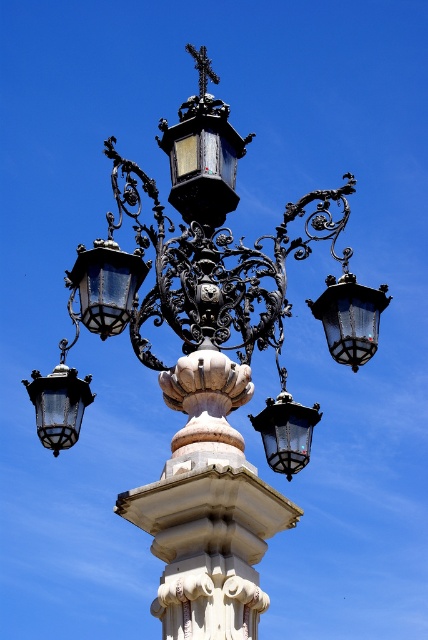
Question: Considering the real-world distances, which object is farthest from the matte black lantern at center?

Choices:
 (A) matte black lantern at upper left
 (B) clear glass lantern at upper right

Answer: (A)

Question: Where is matte black lantern at upper left located in relation to matte black lantern at lower left in the image?

Choices:
 (A) right
 (B) left

Answer: (A)

Question: Is clear glass lantern at upper right positioned before matte black lantern at center?

Choices:
 (A) yes
 (B) no

Answer: (A)

Question: Which point is closer to the camera taking this photo?

Choices:
 (A) (76, 316)
 (B) (297, 468)

Answer: (A)

Question: Considering the relative positions of matte black lantern at upper left and matte black lantern at center in the image provided, where is matte black lantern at upper left located with respect to matte black lantern at center?

Choices:
 (A) right
 (B) left

Answer: (B)

Question: Which object appears farthest from the camera in this image?

Choices:
 (A) matte black lantern at upper left
 (B) matte black lantern at center
 (C) matte black lantern at lower left
 (D) clear glass lantern at upper right

Answer: (B)